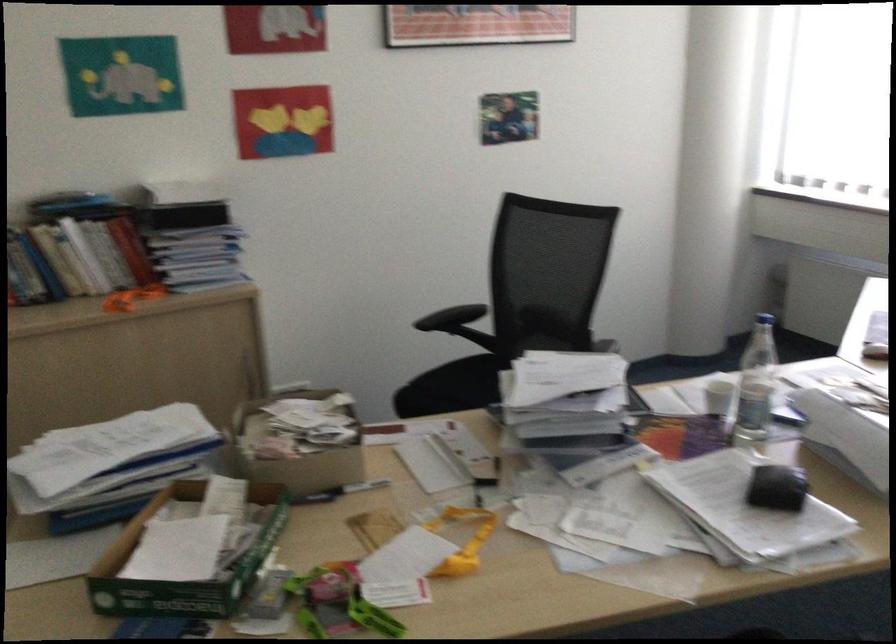
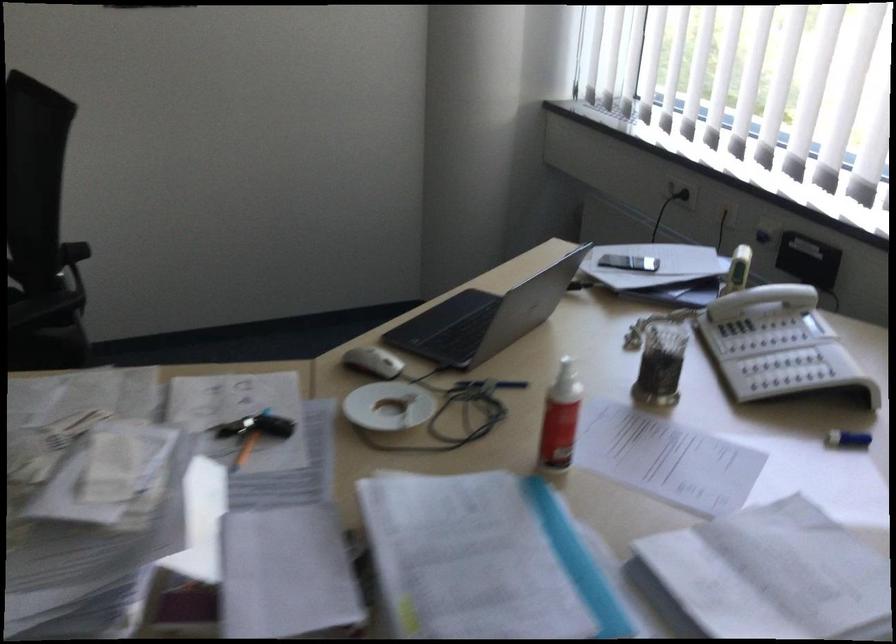
In a continuous first-person perspective shot, in which direction is the camera moving?

The movement direction of the cameraman is right, forward.